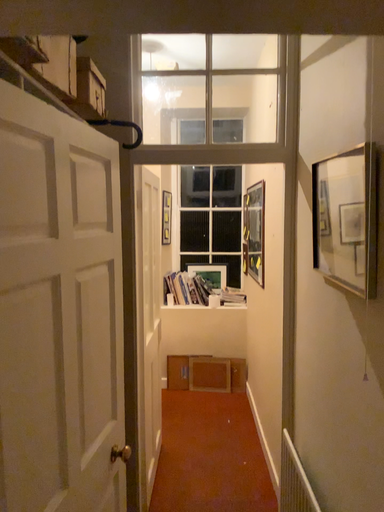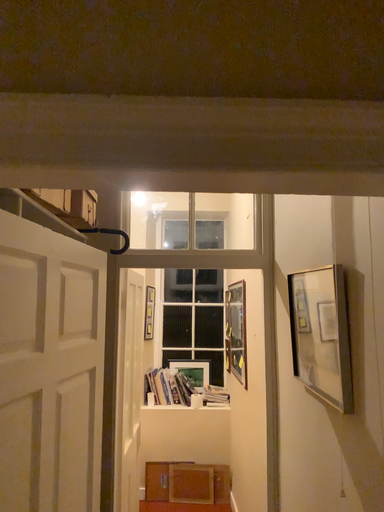
Question: Which way did the camera rotate in the video?

Choices:
 (A) rotated downward
 (B) rotated upward

Answer: (B)